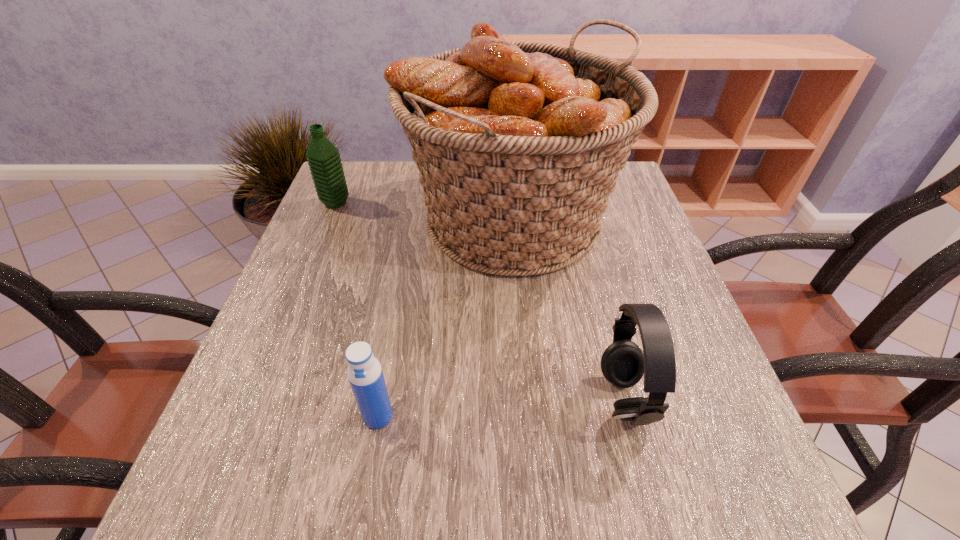
At what (x,y) coordinates should I click in order to perform the action: click on free spot at the near edge of the desktop. Please return your answer as a coordinate pair (x, y). This screenshot has height=540, width=960. Looking at the image, I should click on [466, 523].

The height and width of the screenshot is (540, 960). I want to click on vacant region at the left edge of the desktop, so click(x=322, y=232).

Image resolution: width=960 pixels, height=540 pixels. Identify the location of free region at the right edge of the desktop. (705, 426).

Locate an element on the screen. The image size is (960, 540). vacant point at the far left corner is located at coordinates (351, 204).

Locate an element on the screen. The height and width of the screenshot is (540, 960). free point at the near left corner is located at coordinates (263, 475).

Locate an element on the screen. The image size is (960, 540). free space between the earphone and the tallest object is located at coordinates (568, 309).

Locate an element on the screen. The width and height of the screenshot is (960, 540). blank region between the tallest object and the taller water bottle is located at coordinates (424, 211).

Find the location of `vacant space in between the left water bottle and the earphone`. vacant space in between the left water bottle and the earphone is located at coordinates (480, 301).

Where is `vacant space that's between the right water bottle and the tallest object`? This screenshot has height=540, width=960. vacant space that's between the right water bottle and the tallest object is located at coordinates (445, 318).

Locate an element on the screen. Image resolution: width=960 pixels, height=540 pixels. vacant space that's between the earphone and the right water bottle is located at coordinates (501, 407).